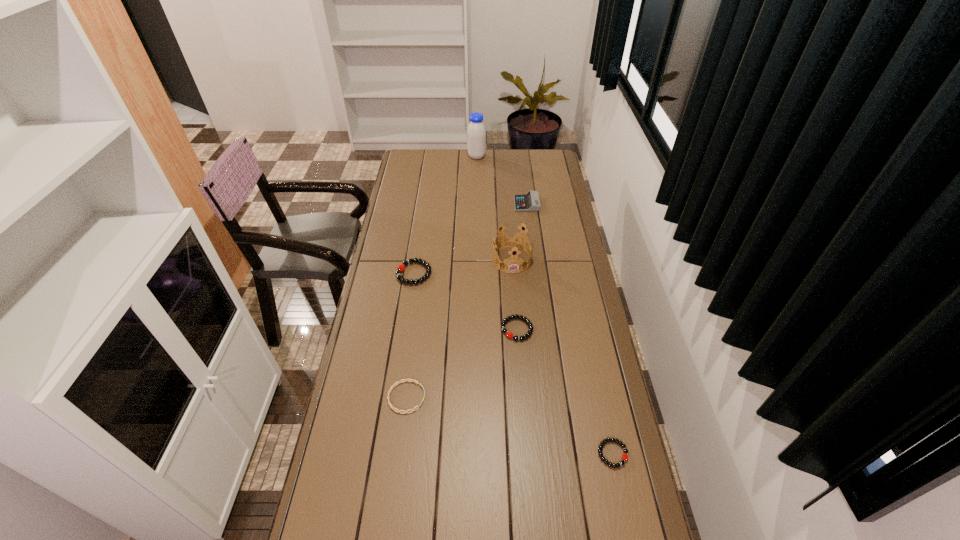
Locate an element on the screen. blue soya milk is located at coordinates (476, 134).

The image size is (960, 540). I want to click on the tallest object, so click(476, 134).

Where is `crown`? This screenshot has width=960, height=540. crown is located at coordinates (512, 241).

I want to click on gray calculator, so click(526, 202).

Identify the location of the fifth shortest object. (526, 202).

Locate an element on the screen. The image size is (960, 540). the farthest bracelet is located at coordinates (401, 267).

In order to click on the tallest bracelet in this screenshot , I will do `click(401, 267)`.

What are the coordinates of `the third nearest bracelet` in the screenshot? It's located at (530, 330).

Locate an element on the screen. This screenshot has width=960, height=540. the third bracelet from left to right is located at coordinates (530, 330).

Find the location of a particular element. The image size is (960, 540). the sixth farthest object is located at coordinates (398, 382).